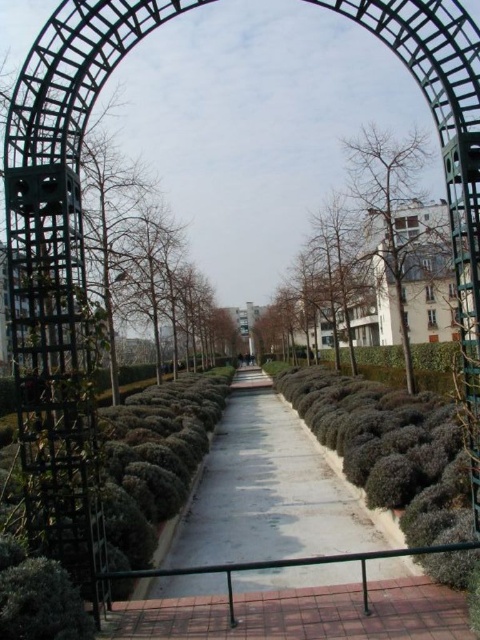
Which is behind, point (328, 502) or point (406, 264)?

The point (406, 264) is behind.

Which is below, smooth concrete path at center or bare branches at center?

smooth concrete path at center

Find the location of a particular element. Image resolution: width=480 pixels, height=640 pixels. smooth concrete path at center is located at coordinates (274, 492).